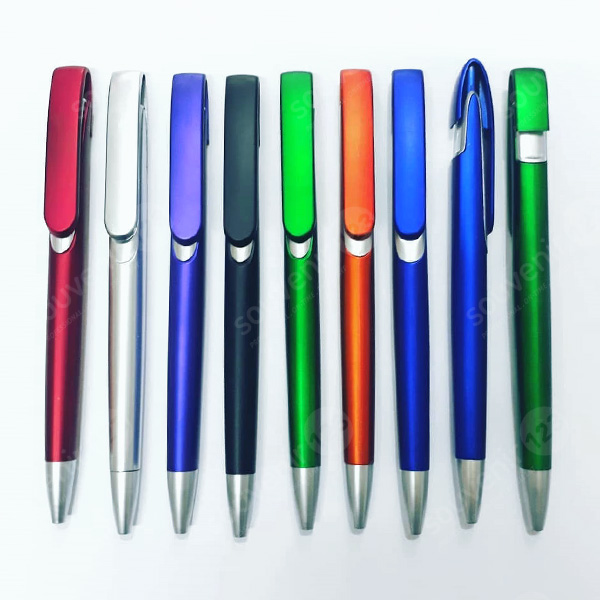
Image resolution: width=600 pixels, height=600 pixels. I want to click on pens, so click(x=55, y=365), click(x=127, y=382), click(x=179, y=407), click(x=249, y=415), click(x=312, y=440), click(x=359, y=442), click(x=413, y=443), click(x=470, y=443), click(x=530, y=442).